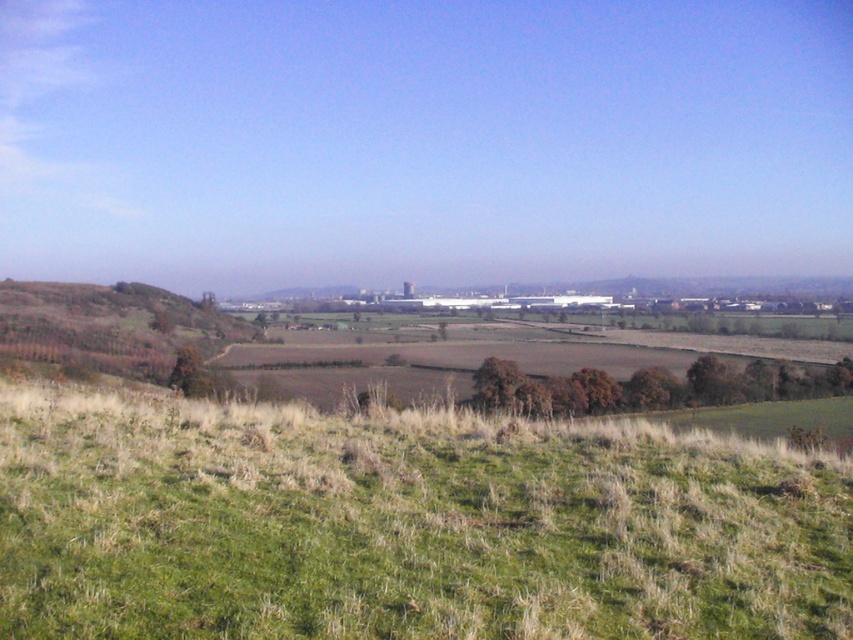
Can you confirm if green grassy hillside at lower center is positioned to the left of brown grassy hillside at left?

No, green grassy hillside at lower center is not to the left of brown grassy hillside at left.

Which of these two, green grassy hillside at lower center or brown grassy hillside at left, stands shorter?

green grassy hillside at lower center is shorter.

Who is more forward, [227,500] or [125,376]?

Point [227,500] is in front.

Identify the location of green grassy hillside at lower center. The image size is (853, 640). (405, 524).